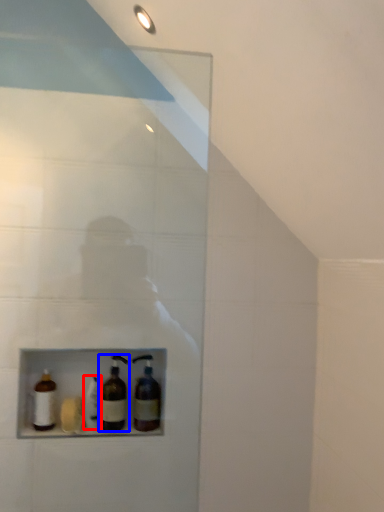
Question: Which object appears closest to the camera in this image, bottle (highlighted by a red box) or bottle (highlighted by a blue box)?

Choices:
 (A) bottle
 (B) bottle

Answer: (B)